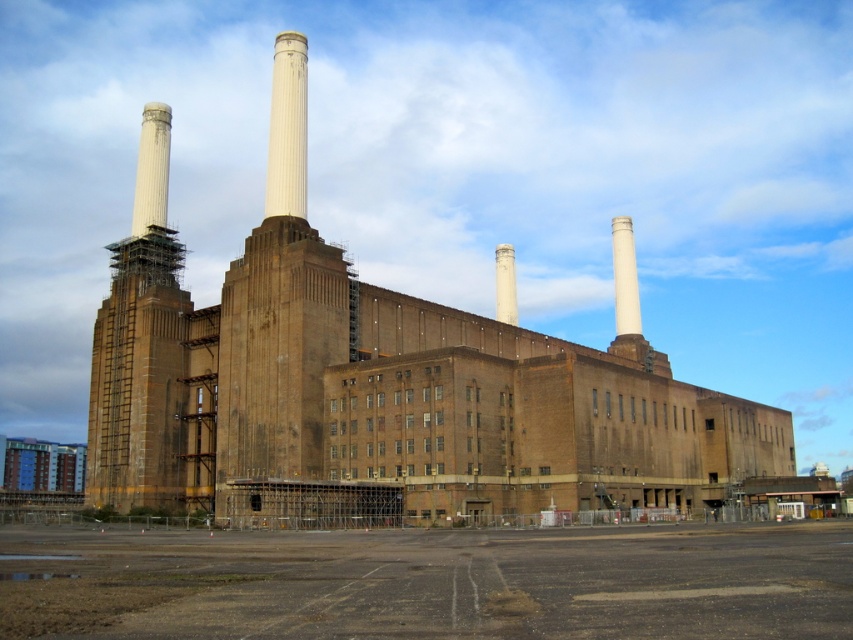
Question: Among these objects, which one is farthest from the camera?

Choices:
 (A) white concrete chimney at center
 (B) smooth white tower at center
 (C) brown brick tower at left
 (D) brown brick building at center

Answer: (A)

Question: In this image, where is brown brick tower at left located relative to white concrete chimney at center?

Choices:
 (A) above
 (B) below

Answer: (B)

Question: Considering the relative positions of brown brick tower at left and white concrete chimney at center in the image provided, where is brown brick tower at left located with respect to white concrete chimney at center?

Choices:
 (A) above
 (B) below

Answer: (B)

Question: Which point appears closest to the camera in this image?

Choices:
 (A) (310, 445)
 (B) (505, 259)

Answer: (A)

Question: Observing the image, what is the correct spatial positioning of smooth white tower at center in reference to brown brick tower at left?

Choices:
 (A) above
 (B) below

Answer: (A)

Question: Which of the following is the farthest from the observer?

Choices:
 (A) brown brick tower at left
 (B) brown brick building at center

Answer: (A)